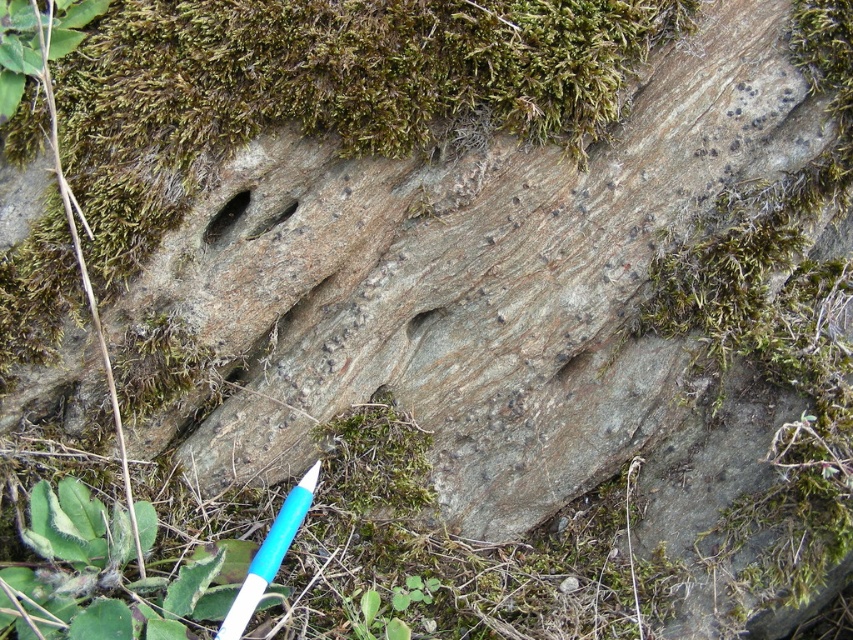
Question: Can you confirm if brown rough hole at center is positioned above smooth stone hole at center?

Choices:
 (A) no
 (B) yes

Answer: (B)

Question: Does brown rough hole at center have a smaller size compared to smooth stone hole at center?

Choices:
 (A) no
 (B) yes

Answer: (A)

Question: Which is farther from the smooth stone hole at center?

Choices:
 (A) white plastic pen at lower left
 (B) brown rough hole at center
 (C) green mossy rock at upper center

Answer: (A)

Question: Does white plastic pen at lower left appear on the left side of brown rough hole at center?

Choices:
 (A) yes
 (B) no

Answer: (B)

Question: Estimate the real-world distances between objects in this image. Which object is closer to the white plastic pen at lower left?

Choices:
 (A) brown rough hole at center
 (B) green mossy rock at upper center

Answer: (A)

Question: Which point is farther to the camera?

Choices:
 (A) (287, 205)
 (B) (444, 12)

Answer: (A)